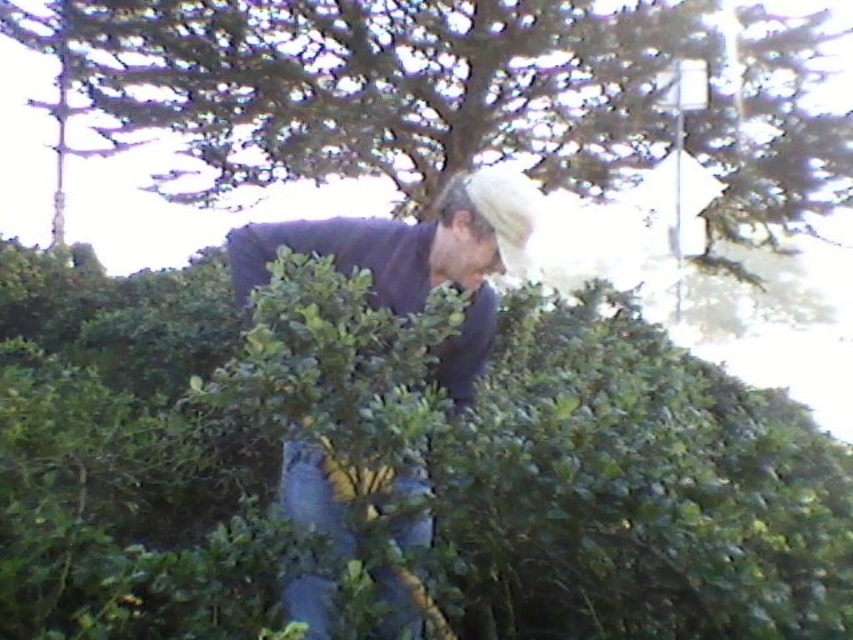
Question: Is green leafy hedge at center thinner than green leafy bush at center?

Choices:
 (A) yes
 (B) no

Answer: (B)

Question: Which object appears farthest from the camera in this image?

Choices:
 (A) green leafy bush at center
 (B) dark blue sweater at center
 (C) green leafy hedge at center

Answer: (A)

Question: Does green leafy hedge at center have a lesser width compared to dark blue sweater at center?

Choices:
 (A) yes
 (B) no

Answer: (B)

Question: Does dark blue sweater at center appear on the left side of green leafy bush at center?

Choices:
 (A) yes
 (B) no

Answer: (B)

Question: Which of the following is the farthest from the observer?

Choices:
 (A) (764, 636)
 (B) (381, 262)
 (C) (218, 227)

Answer: (C)

Question: Which object is positioned closest to the green leafy hedge at center?

Choices:
 (A) dark blue sweater at center
 (B) green leafy bush at center

Answer: (A)